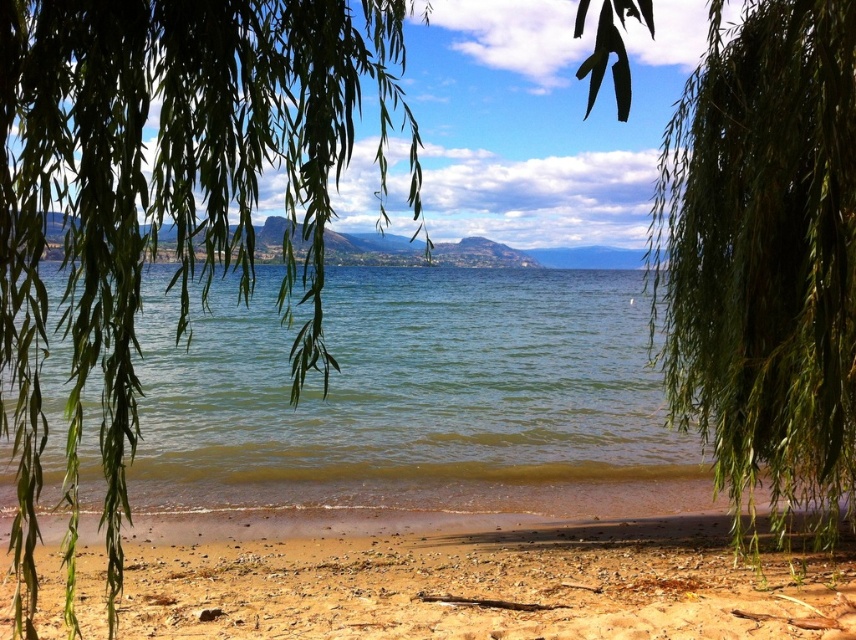
You are standing at the edge of the brown sandy beach at lower center and want to see the distant mountains. Can you see them clearly through the green leafy tree at center?

The green leafy tree at center is positioned over brown sandy beach at lower center, so it may block your view of the distant mountains.

You are standing at the lakeside and see the point marked as point [765,257]. Which object does this point correspond to?

The point [765,257] corresponds to the green leafy branch at center.

You are standing at the lakeside and see the green leafy tree at center and the green leafy branch at center. Which one is closer to you?

The green leafy tree at center is closer to you because it is in front of the green leafy branch at center.